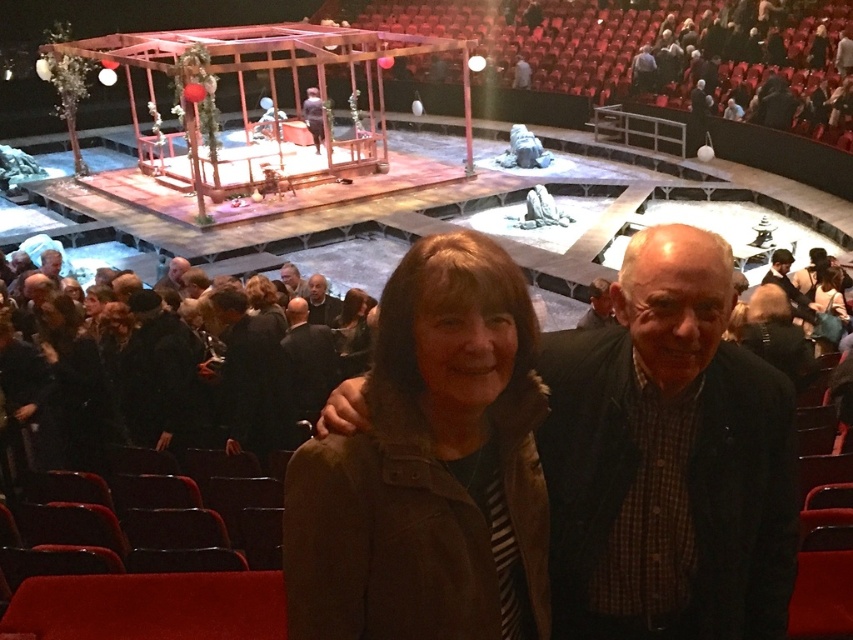
You are a photographer standing in the theater. You notice the smooth brown leather jacket at lower center and the light brown hair at center. Which object is closer to you, the photographer?

The smooth brown leather jacket at lower center is closer to you because it is in front of the light brown hair at center.

You are a photographer trying to capture the perfect shot of the smooth brown leather jacket at lower center and the light brown hair at center. Which object should you focus on first if you want to ensure both are in focus without adjusting the camera settings?

The smooth brown leather jacket at lower center is located above the light brown hair at center. Since the jacket is higher up, focusing on it first might help ensure both are in focus, but this depends on the camera settings and depth of field. However, based on their positions, starting with the jacket could be strategic.

You are a photographer trying to capture a clear shot of both the gray wool sweater at center and the smooth brown leather jacket at lower center. Since you want both items to be visible, which one should you focus on first to ensure the other remains in focus?

The gray wool sweater at center is in front of the smooth brown leather jacket at lower center. To ensure both are in focus, you should focus on the gray wool sweater at center first, as it is closer to the camera, and the jacket behind it will naturally fall into focus with proper depth of field.